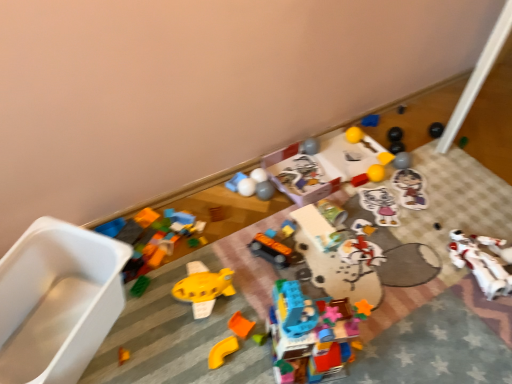
Identify the location of free space between white plastic robot at lower right, the first toy positioned from the right, and orange matte plastic toy at lower center, the fifteenth toy viewed from the right. (390, 296).